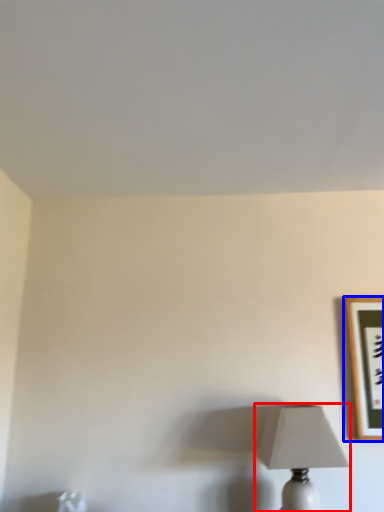
Question: Which of the following is the closest to the observer, lamp (highlighted by a red box) or picture frame (highlighted by a blue box)?

Choices:
 (A) lamp
 (B) picture frame

Answer: (A)